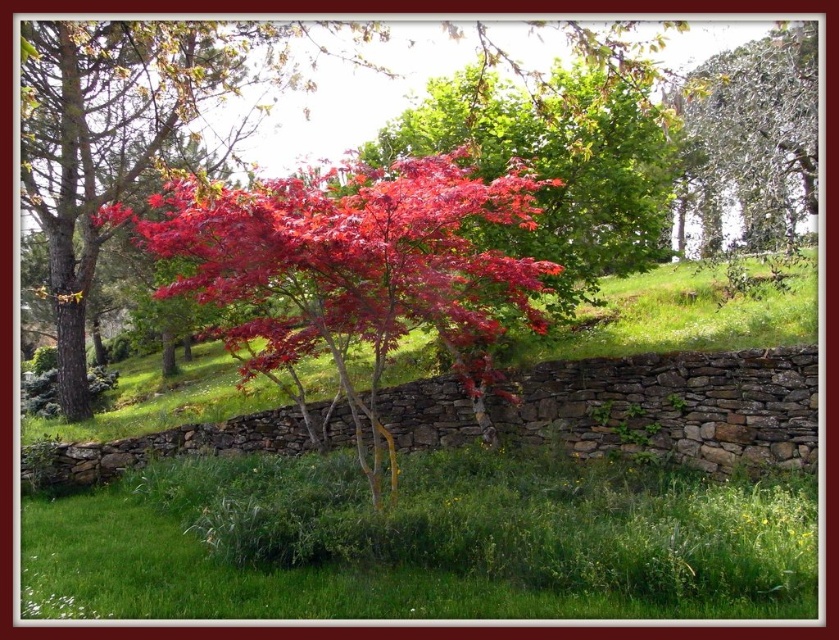
Between point (60, 29) and point (712, 161), which one is positioned behind?

Positioned behind is point (712, 161).

Who is positioned more to the left, glossy red maple tree at center or green leafy tree at upper right?

glossy red maple tree at center is more to the left.

Identify the location of glossy red maple tree at center. Image resolution: width=839 pixels, height=640 pixels. (131, 128).

Is green grass at lower center taller than green leafy tree at upper right?

No.

How distant is green grass at lower center from green leafy tree at upper right?

30.40 feet

Where is `green grass at lower center`? green grass at lower center is located at coordinates (426, 540).

Does point (238, 234) come farther from viewer compared to point (38, 61)?

No.

Which of these two, glossy red maple at center or glossy red maple tree at center, stands taller?

glossy red maple tree at center is taller.

Is point (300, 332) in front of point (122, 36)?

Yes, point (300, 332) is in front of point (122, 36).

Locate an element on the screen. The height and width of the screenshot is (640, 839). glossy red maple at center is located at coordinates (352, 268).